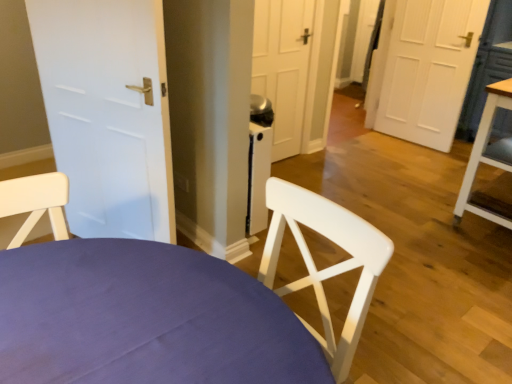
Question: From a real-world perspective, is white wood chair at center positioned above or below white matte door at left?

Choices:
 (A) below
 (B) above

Answer: (A)

Question: Considering the relative positions of white wood chair at center and white matte door at left in the image provided, is white wood chair at center to the left or to the right of white matte door at left?

Choices:
 (A) left
 (B) right

Answer: (B)

Question: Estimate the real-world distances between objects in this image. Which object is farther from the white matte door at left?

Choices:
 (A) wooden table at right
 (B) white wood chair at center

Answer: (A)

Question: Considering the real-world distances, which object is closest to the white matte door at left?

Choices:
 (A) white wood chair at center
 (B) wooden table at right

Answer: (A)